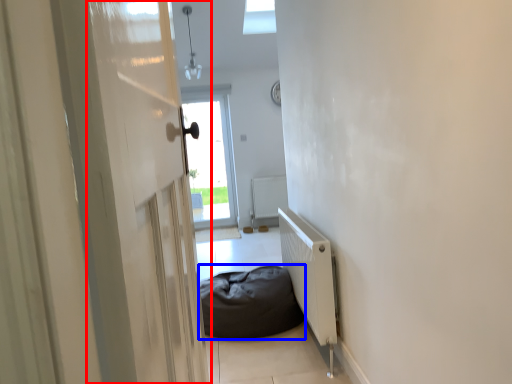
Question: Which object is further to the camera taking this photo, screen door (highlighted by a red box) or furniture (highlighted by a blue box)?

Choices:
 (A) screen door
 (B) furniture

Answer: (B)